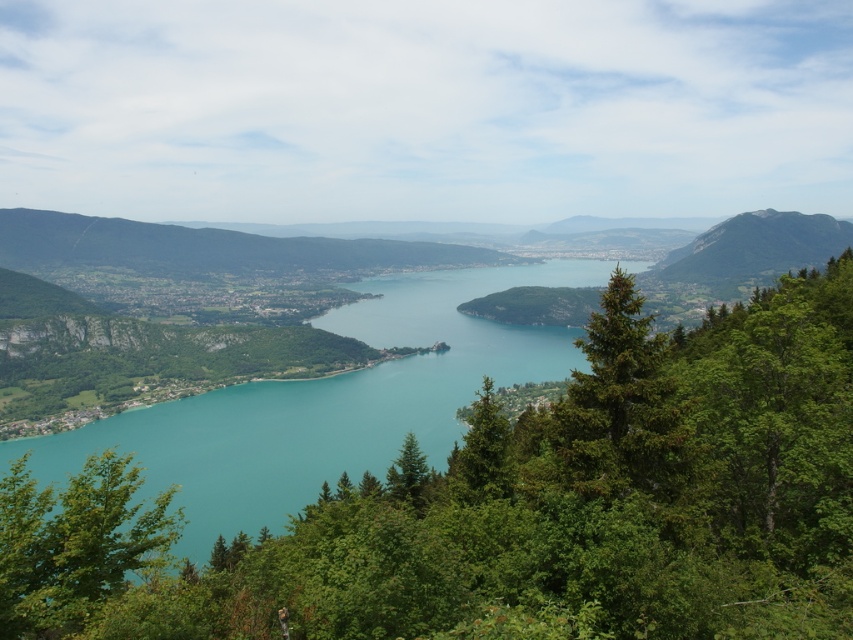
Based on the photo, you are standing in a forest overlooking a lake and see two points marked in the scene. Which point, point (466, 499) or point (119, 563), is closer to you?

Point (466, 499) is closer to you because it is further to the viewer than point (119, 563).

You are standing in the forest area in the foreground of the image and want to reach the lake. Which direction should you walk to avoid the green leafy tree at center?

Since the green leafy tree at center is located at point coordinates of 0.792 on the x axis and 0.607 on the y axis, you should walk in a direction away from those coordinates to avoid it while heading towards the lake.